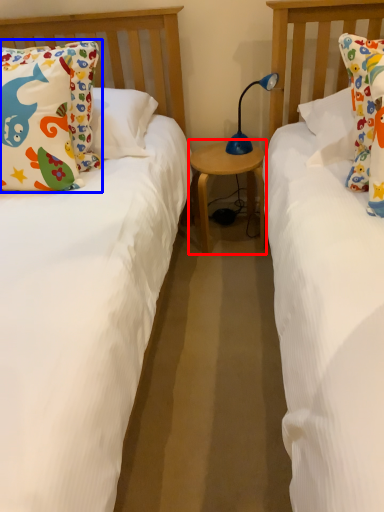
Question: Which of the following is the closest to the observer, table (highlighted by a red box) or pillow (highlighted by a blue box)?

Choices:
 (A) table
 (B) pillow

Answer: (B)